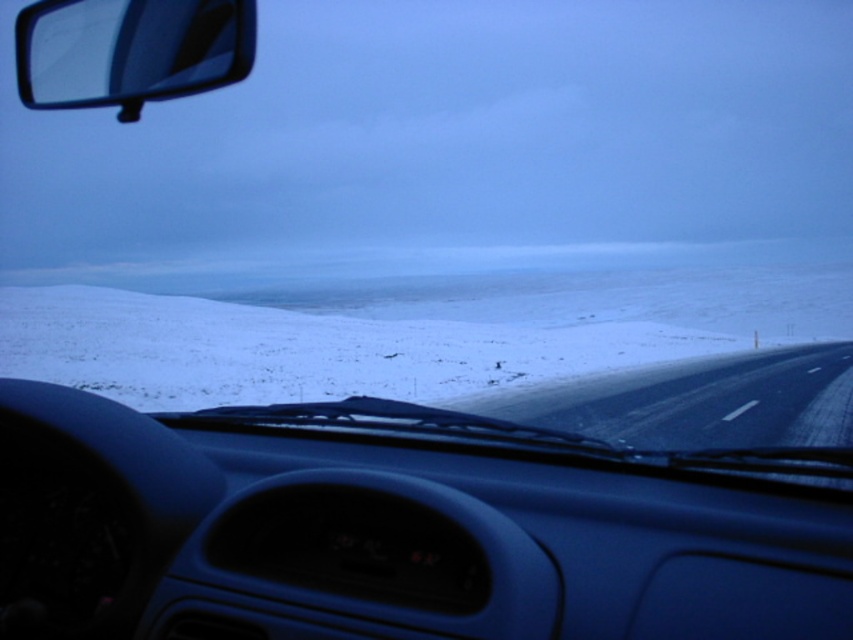
Question: Does white powdery snow at center have a larger size compared to transparent glass side mirror at upper left?

Choices:
 (A) yes
 (B) no

Answer: (B)

Question: Does white powdery snow at center appear under transparent glass side mirror at upper left?

Choices:
 (A) no
 (B) yes

Answer: (B)

Question: Can you confirm if white powdery snow at center is positioned to the left of transparent glass side mirror at upper left?

Choices:
 (A) yes
 (B) no

Answer: (B)

Question: Among these objects, which one is nearest to the camera?

Choices:
 (A) transparent glass side mirror at upper left
 (B) white powdery snow at center

Answer: (A)